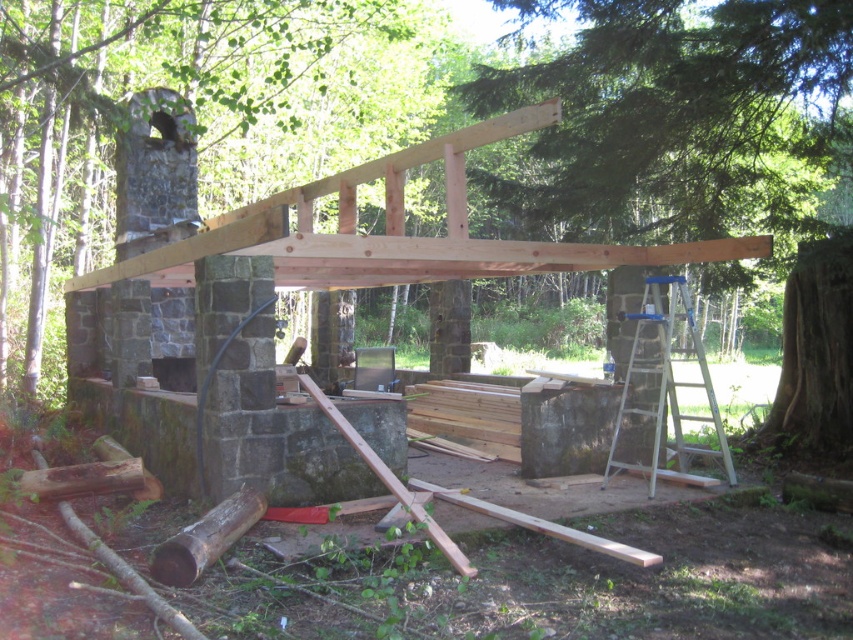
Is natural wood beam at center closer to camera compared to metallic silver ladder at right?

No, it is behind metallic silver ladder at right.

Identify the location of natural wood beam at center. (706, 157).